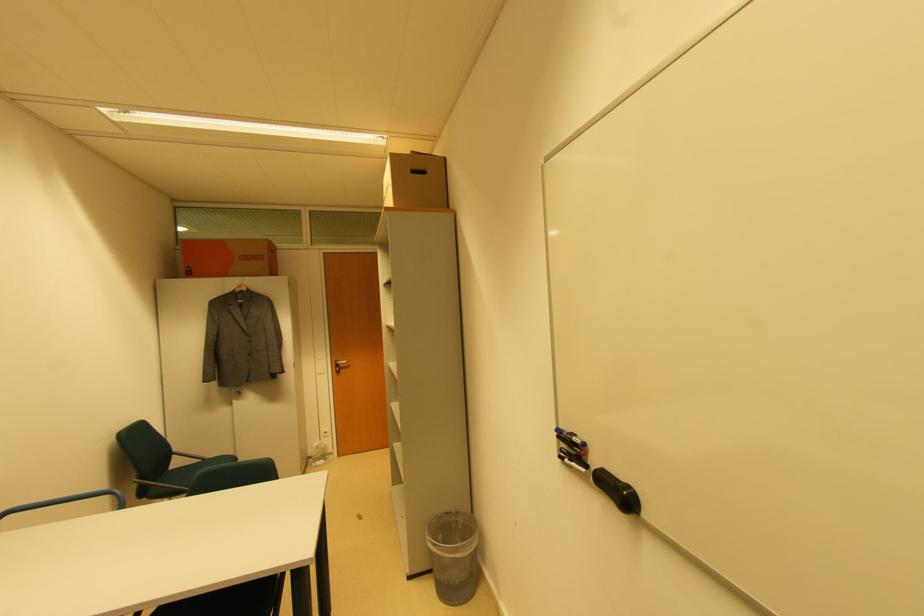
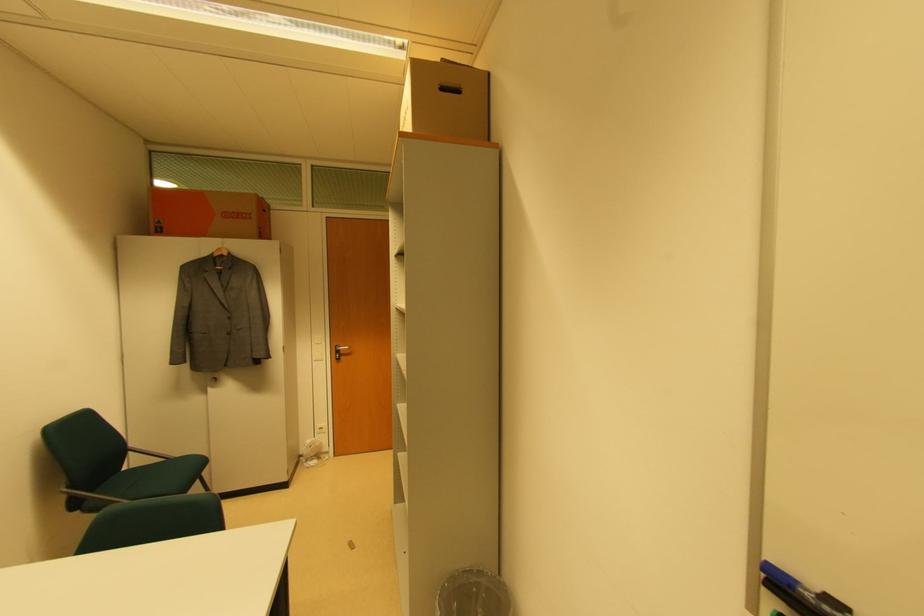
The point at (457, 515) is marked in the first image. Where is the corresponding point in the second image?

(480, 575)